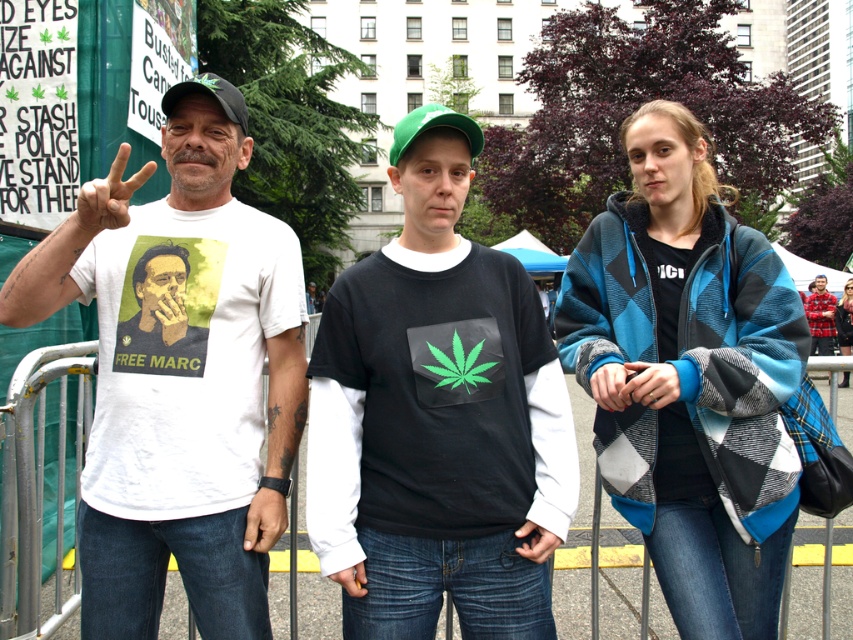
Question: Among these points, which one is farthest from the camera?

Choices:
 (A) (834, 305)
 (B) (311, 346)
 (C) (225, 154)

Answer: (A)

Question: Is black matte shirt at center smaller than matte skin hand at center?

Choices:
 (A) yes
 (B) no

Answer: (B)

Question: Observing the image, what is the correct spatial positioning of metal at center in reference to plaid flannel shirt at center?

Choices:
 (A) above
 (B) below

Answer: (B)

Question: Does blue-and-black checkered jacket at center appear under matte white t-shirt with graphic at center?

Choices:
 (A) no
 (B) yes

Answer: (B)

Question: Which point is closer to the camera?

Choices:
 (A) (453, 372)
 (B) (143, 260)
 (C) (138, 609)
 (D) (834, 316)

Answer: (A)

Question: Which of the following is the closest to the observer?

Choices:
 (A) (231, 524)
 (B) (813, 282)
 (C) (840, 380)

Answer: (A)